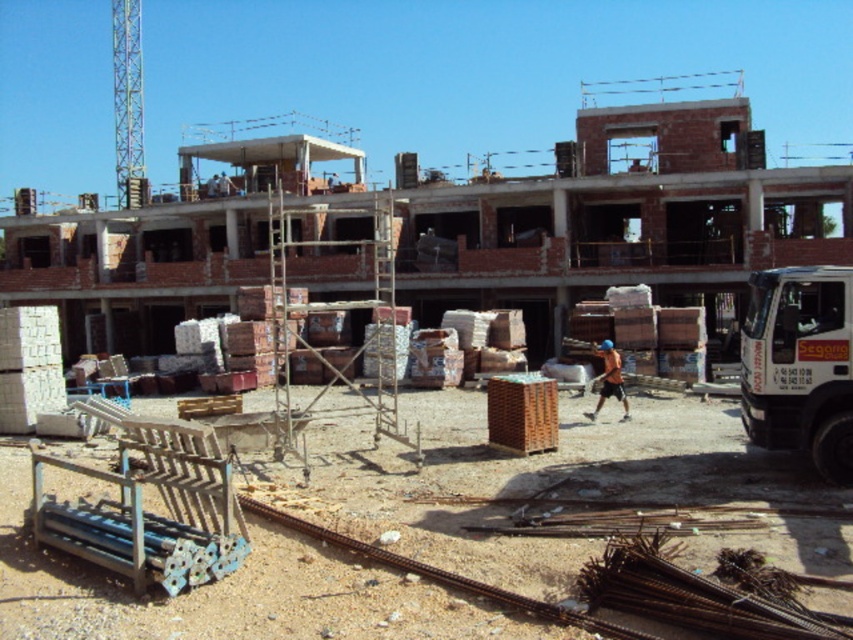
Measure the distance between black metal train track at lower center and orange fabric construction worker at center.

black metal train track at lower center and orange fabric construction worker at center are 30.51 feet apart from each other.

Looking at this image, is black metal train track at lower center wider than orange fabric construction worker at center?

Yes.

Who is more distant from viewer, [643,637] or [624,403]?

Positioned behind is point [624,403].

In order to click on black metal train track at lower center in this screenshot , I will do `click(440, 573)`.